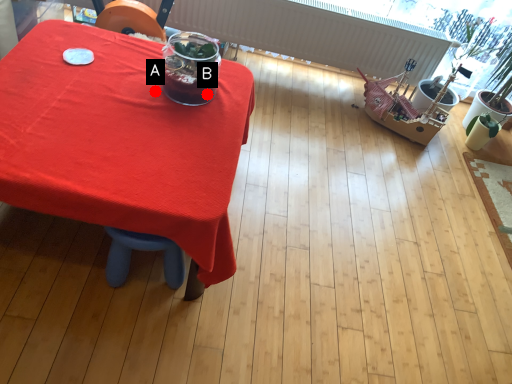
Question: Two points are circled on the image, labeled by A and B beside each circle. Which point is closer to the camera?

Choices:
 (A) A is closer
 (B) B is closer

Answer: (B)